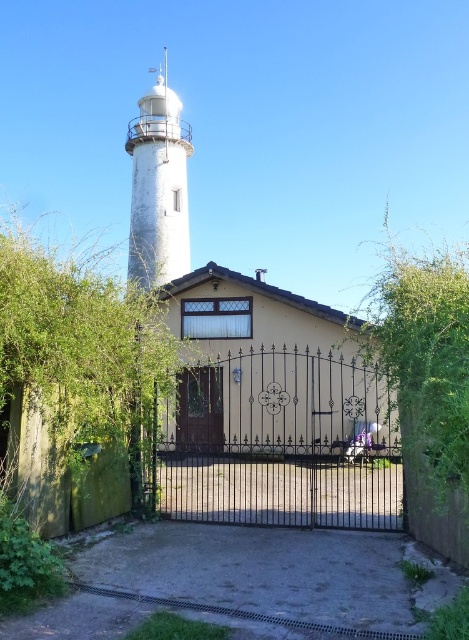
Question: Is white matte/light tower at upper left below brown wooden door at center?

Choices:
 (A) no
 (B) yes

Answer: (A)

Question: Which object is the closest to the black wrought iron gate at center?

Choices:
 (A) brown wooden door at center
 (B) white matte/light tower at upper left

Answer: (A)

Question: Which of the following is the farthest from the observer?

Choices:
 (A) (188, 266)
 (B) (197, 403)
 (C) (205, 440)

Answer: (A)

Question: Is white matte/light tower at upper left thinner than brown wooden door at center?

Choices:
 (A) no
 (B) yes

Answer: (A)

Question: Which object is the closest to the white matte/light tower at upper left?

Choices:
 (A) black wrought iron gate at center
 (B) brown wooden door at center

Answer: (B)

Question: Observing the image, what is the correct spatial positioning of white matte/light tower at upper left in reference to brown wooden door at center?

Choices:
 (A) below
 (B) above

Answer: (B)